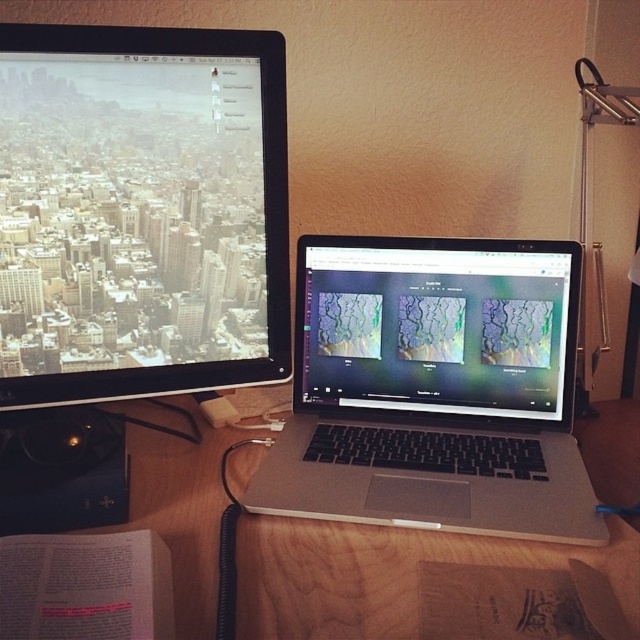
Question: Based on their relative distances, which object is nearer to the matte plastic laptop at center?

Choices:
 (A) silver metallic laptop at center
 (B) matte black monitor at upper left
 (C) wooden table at center

Answer: (A)

Question: Can you confirm if matte black monitor at upper left is bigger than matte plastic laptop at center?

Choices:
 (A) no
 (B) yes

Answer: (B)

Question: Which is nearer to the silver metallic laptop at center?

Choices:
 (A) matte black monitor at upper left
 (B) matte plastic laptop at center
 (C) wooden table at center

Answer: (B)

Question: Can you confirm if silver metallic laptop at center is smaller than wooden table at center?

Choices:
 (A) no
 (B) yes

Answer: (B)

Question: Which object is closer to the camera taking this photo?

Choices:
 (A) silver metallic laptop at center
 (B) matte plastic laptop at center

Answer: (A)

Question: Is matte black monitor at upper left to the right of wooden table at center from the viewer's perspective?

Choices:
 (A) yes
 (B) no

Answer: (B)